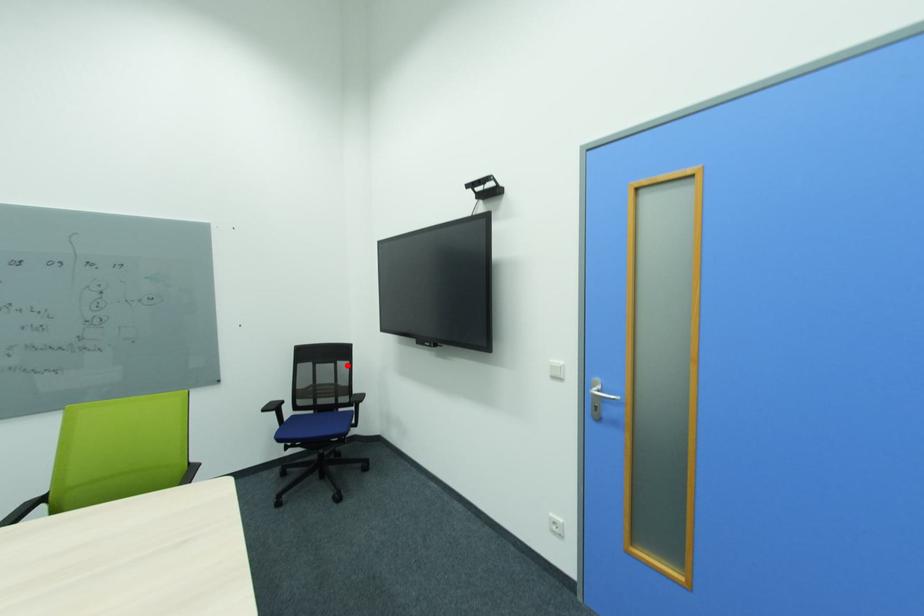
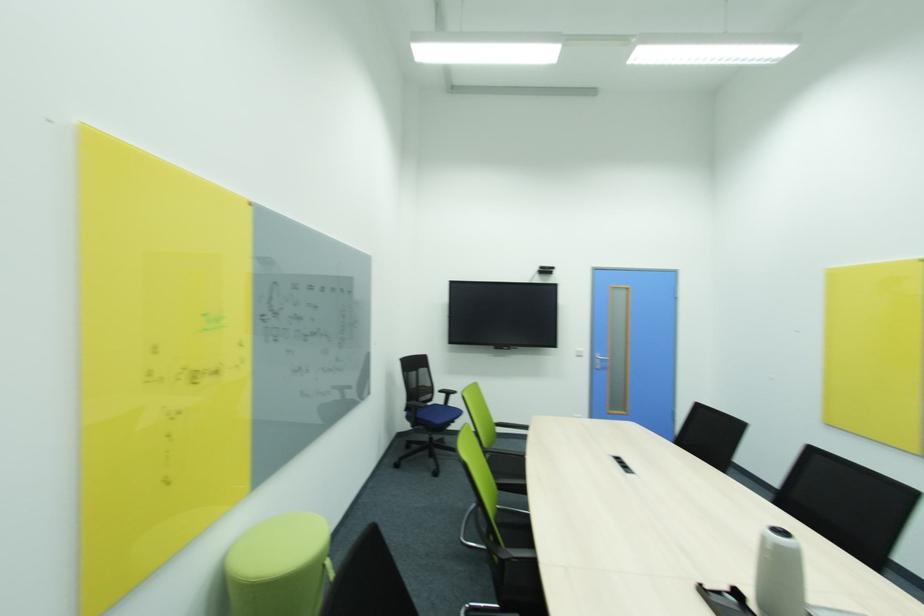
Where in the second image is the point corresponding to the highlighted location from the first image?

(428, 371)